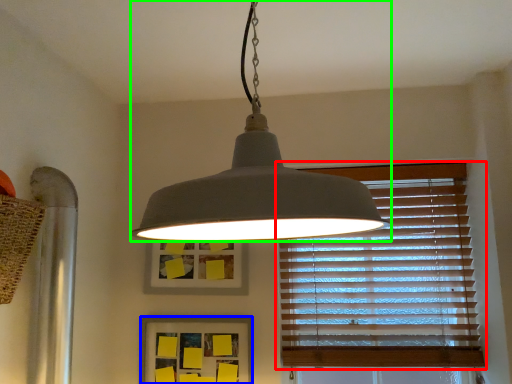
Question: Considering the real-world distances, which object is closest to window blind (highlighted by a red box)? picture frame (highlighted by a blue box) or lamp (highlighted by a green box).

Choices:
 (A) picture frame
 (B) lamp

Answer: (A)